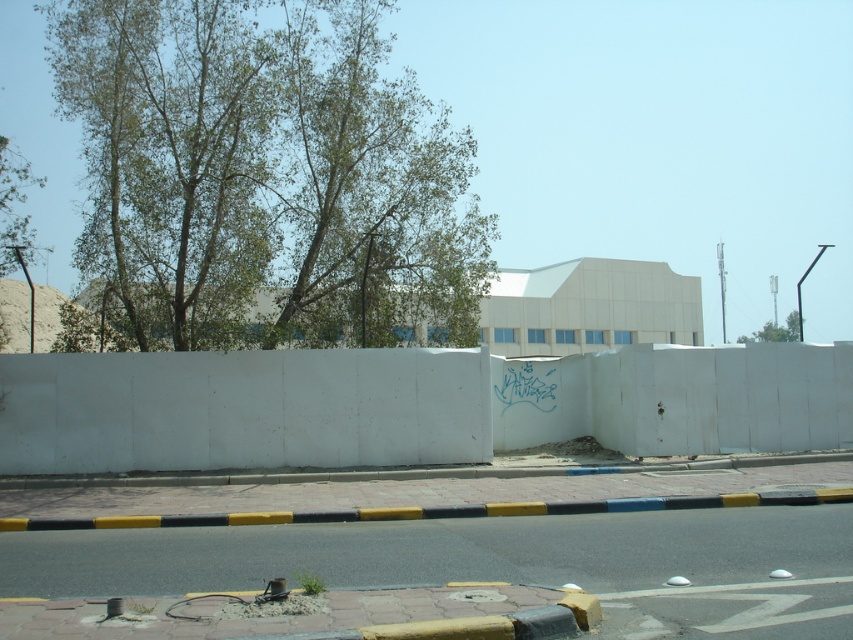
You are standing at the center of the road and want to take a photo of the green leafy tree at upper left. In which direction should you point your camera to capture it?

The green leafy tree at upper left is located at point 0.277 on the x axis and 0.312 on the y axis, so you should point your camera towards the upper left direction to capture it.

You are standing in front of the white concrete wall in the urban scene. There are two points marked on the wall. The first point is at coordinates point (689, 502) and the second point is at point (788, 330). Which point is closer to you?

Point (689, 502) is closer to the camera than point (788, 330).